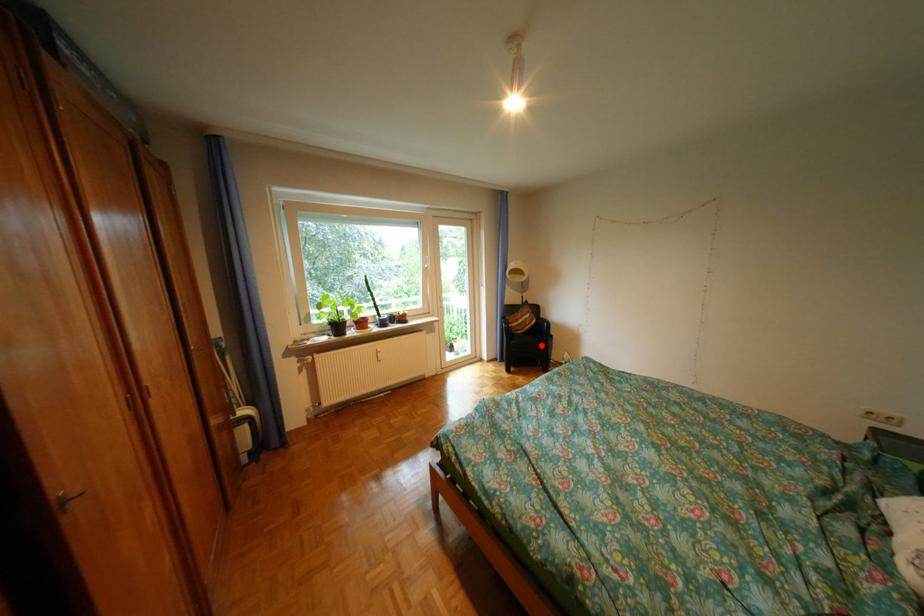
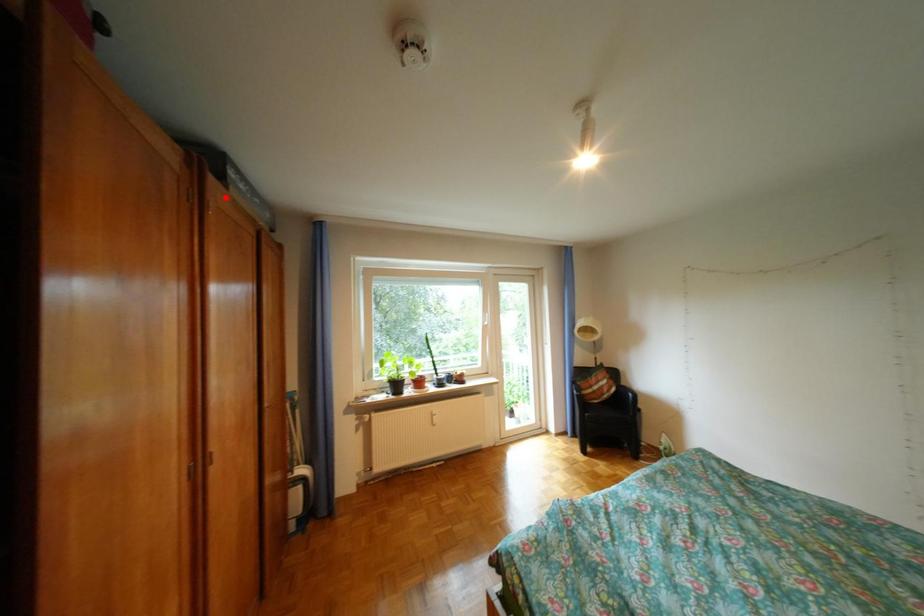
I am providing you with two images of the same scene from different viewpoints. A red point is marked on the first image and another point is marked on the second image. Do the highlighted points in image1 and image2 indicate the same real-world spot?

No